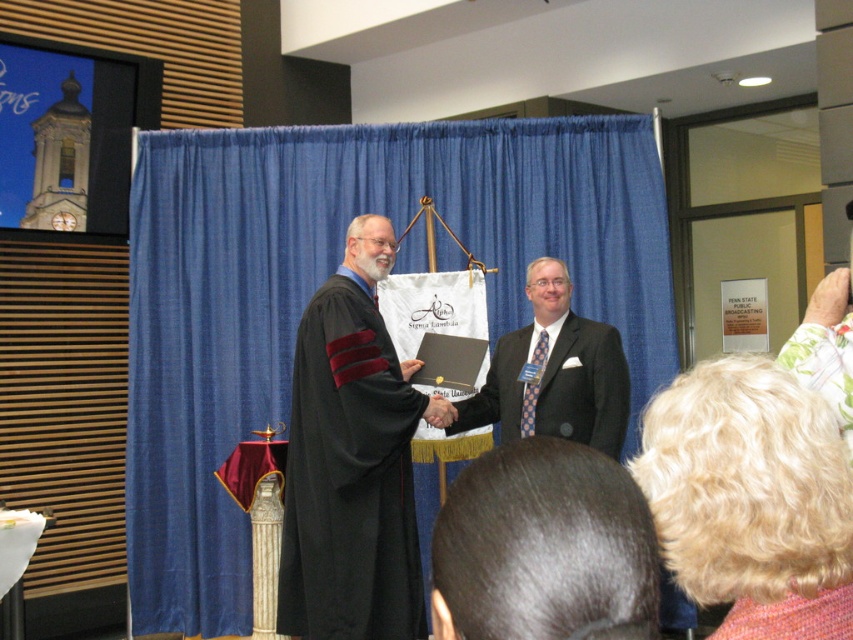
You are an event organizer setting up the stage for the ceremony. You need to place a podium at the exact center of the stage. The blue fabric curtain at center is currently at coordinates point 0.436, 0.382. Is the curtain positioned correctly for the center of the stage?

The blue fabric curtain at center is located at point [325,278], so it is positioned correctly at the center of the stage.

You are attending the event and want to take a photo of the dark brown hair at center without the blue fabric curtain at center appearing in the background. Is this possible given their positions?

The dark brown hair at center is behind the blue fabric curtain at center, so it is not possible to capture the dark brown hair at center without the curtain appearing in the background.

You are an attendee sitting in the front row of the event. You want to hand a flower bouquet to the man on stage who is receiving the diploma. The bouquet is 3 feet wide. Is there enough space between you and the blue fabric curtain at center to extend your arm without hitting the curtain?

The blue fabric curtain at center is 15.51 feet away from the viewer. Since the bouquet is only 3 feet wide, there is ample space between you and the curtain to extend your arm without any obstruction.